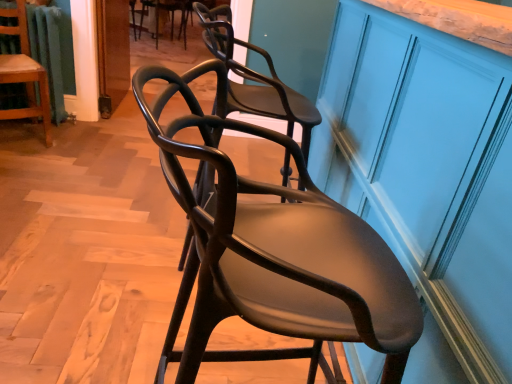
Question: From the image's perspective, is matte dark wood chair at center, which is the 3th chair in back-to-front order, below matte black chair at upper center, the second chair when ordered from right to left?

Choices:
 (A) yes
 (B) no

Answer: (A)

Question: Is matte dark wood chair at center, acting as the 3th chair starting from the left, completely or partially outside of matte black chair at upper center, marked as the 2th chair in a left-to-right arrangement?

Choices:
 (A) yes
 (B) no

Answer: (A)

Question: Would you consider matte dark wood chair at center, acting as the 3th chair starting from the left, to be distant from matte black chair at upper center, the 1th chair when ordered from back to front?

Choices:
 (A) yes
 (B) no

Answer: (A)

Question: Can you confirm if matte dark wood chair at center, which is the 3th chair in back-to-front order, is smaller than matte black chair at upper center, marked as the 2th chair in a left-to-right arrangement?

Choices:
 (A) no
 (B) yes

Answer: (A)

Question: Is matte dark wood chair at center, the first chair viewed from the front, bigger than matte black chair at upper center, the 1th chair when ordered from back to front?

Choices:
 (A) no
 (B) yes

Answer: (B)

Question: From the image's perspective, is matte dark wood chair at center, placed as the third chair when sorted from top to bottom, on matte black chair at upper center, the second chair when ordered from right to left?

Choices:
 (A) yes
 (B) no

Answer: (B)

Question: Is wooden chair at left, which is counted as the second chair, starting from the bottom, wider than matte dark wood chair at center, which is the 3th chair in back-to-front order?

Choices:
 (A) yes
 (B) no

Answer: (B)

Question: Is wooden chair at left, placed as the third chair when sorted from right to left, not within matte dark wood chair at center, which appears as the 1th chair when ordered from the bottom?

Choices:
 (A) no
 (B) yes

Answer: (B)

Question: Can you confirm if wooden chair at left, placed as the third chair when sorted from right to left, is bigger than matte dark wood chair at center, acting as the 3th chair starting from the left?

Choices:
 (A) no
 (B) yes

Answer: (A)

Question: From a real-world perspective, is wooden chair at left, which appears as the 2th chair when viewed from the back, on matte dark wood chair at center, acting as the 3th chair starting from the left?

Choices:
 (A) yes
 (B) no

Answer: (B)

Question: Is wooden chair at left, acting as the 1th chair starting from the left, aimed at matte dark wood chair at center, which appears as the 1th chair when ordered from the bottom?

Choices:
 (A) no
 (B) yes

Answer: (B)

Question: Considering the relative sizes of wooden chair at left, placed as the third chair when sorted from right to left, and matte dark wood chair at center, the first chair viewed from the front, in the image provided, is wooden chair at left, placed as the third chair when sorted from right to left, smaller than matte dark wood chair at center, the first chair viewed from the front,?

Choices:
 (A) no
 (B) yes

Answer: (B)

Question: Does matte blue cabinet at right lie behind wooden chair at left, which appears as the second chair when viewed from the top?

Choices:
 (A) yes
 (B) no

Answer: (B)